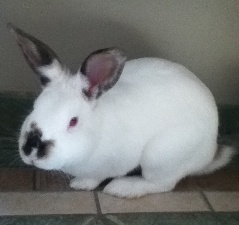
The width and height of the screenshot is (239, 225). I want to click on shadow on wall, so click(x=121, y=35).